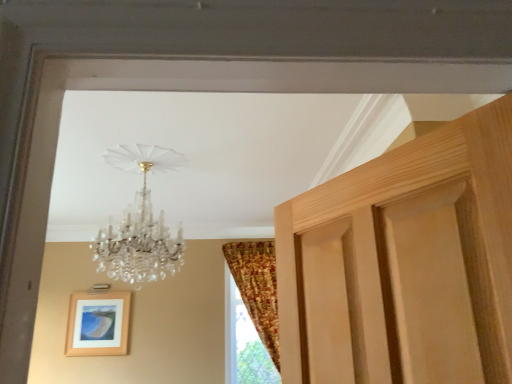
Question: In the image, is crystal glass chandelier at upper center positioned in front of or behind patterned fabric curtain at right?

Choices:
 (A) front
 (B) behind

Answer: (A)

Question: Choose the correct answer: Is crystal glass chandelier at upper center inside patterned fabric curtain at right or outside it?

Choices:
 (A) outside
 (B) inside

Answer: (A)

Question: Which is farther from the crystal glass chandelier at upper center?

Choices:
 (A) wooden picture frame at lower left
 (B) patterned fabric curtain at right

Answer: (A)

Question: Considering the real-world distances, which object is farthest from the patterned fabric curtain at right?

Choices:
 (A) crystal glass chandelier at upper center
 (B) wooden picture frame at lower left

Answer: (A)